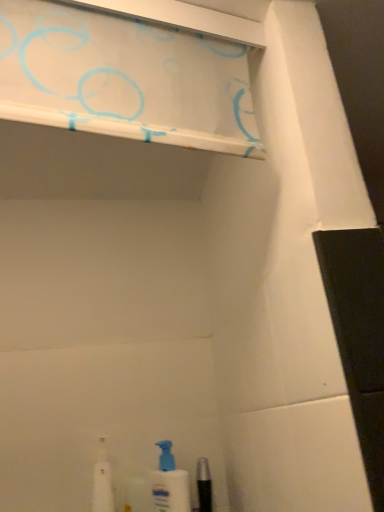
Question: Can you confirm if white plastic bottle at lower left is wider than white plastic spray bottle at lower center?

Choices:
 (A) yes
 (B) no

Answer: (A)

Question: Is white plastic spray bottle at lower center inside white plastic bottle at lower left?

Choices:
 (A) yes
 (B) no

Answer: (B)

Question: Can you confirm if white plastic bottle at lower left is positioned to the left of white plastic spray bottle at lower center?

Choices:
 (A) yes
 (B) no

Answer: (A)

Question: Does white plastic bottle at lower left have a lesser height compared to white plastic spray bottle at lower center?

Choices:
 (A) yes
 (B) no

Answer: (B)

Question: Is white plastic bottle at lower left in front of white plastic spray bottle at lower center?

Choices:
 (A) no
 (B) yes

Answer: (B)

Question: Is white plastic bottle at lower left next to white plastic spray bottle at lower center and touching it?

Choices:
 (A) no
 (B) yes

Answer: (A)

Question: Is white plastic spray bottle at lower center to the right of white glossy shelf at upper center from the viewer's perspective?

Choices:
 (A) yes
 (B) no

Answer: (A)

Question: Considering the relative sizes of white plastic spray bottle at lower center and white glossy shelf at upper center in the image provided, is white plastic spray bottle at lower center taller than white glossy shelf at upper center?

Choices:
 (A) no
 (B) yes

Answer: (B)

Question: Is white plastic spray bottle at lower center in contact with white glossy shelf at upper center?

Choices:
 (A) no
 (B) yes

Answer: (A)

Question: From the image's perspective, is white plastic spray bottle at lower center above white glossy shelf at upper center?

Choices:
 (A) yes
 (B) no

Answer: (B)

Question: Does white plastic spray bottle at lower center have a greater width compared to white glossy shelf at upper center?

Choices:
 (A) no
 (B) yes

Answer: (B)

Question: From the image's perspective, is white plastic spray bottle at lower center beneath white glossy shelf at upper center?

Choices:
 (A) yes
 (B) no

Answer: (A)

Question: Are white plastic bottle at lower left and white glossy shelf at upper center making contact?

Choices:
 (A) no
 (B) yes

Answer: (A)